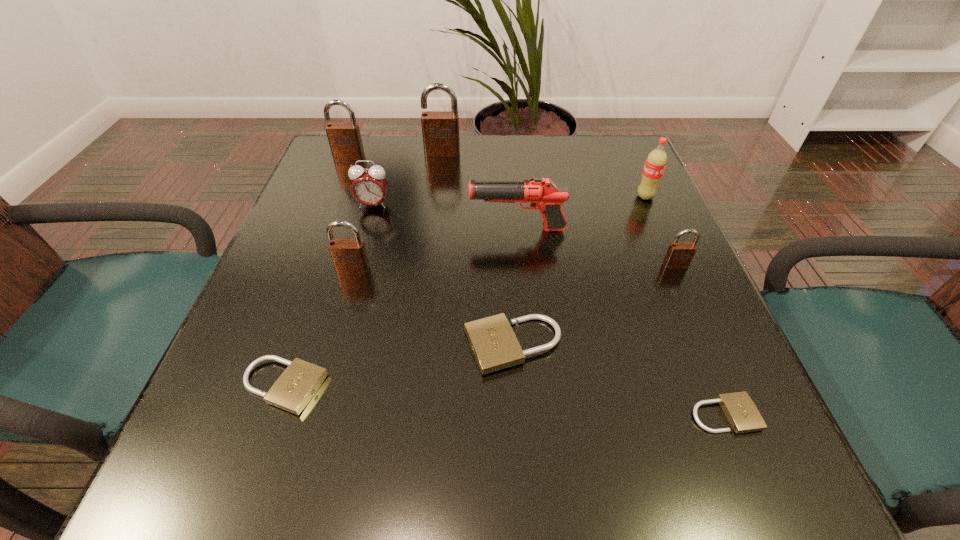
You are a GUI agent. You are given a task and a screenshot of the screen. Output one action in this format:
    pyautogui.click(x=<x>, y=<y>)
    Task: Click on the second brown padlock from right to left
    The image size is (960, 540).
    Given the screenshot: What is the action you would take?
    pyautogui.click(x=440, y=129)

Identify the location of the fifth object from left to right. The image size is (960, 540). (440, 129).

Locate an element on the screen. the leftmost brown padlock is located at coordinates (345, 141).

Find the location of a particular element. the second biggest brown padlock is located at coordinates (345, 141).

Where is `soda`? The width and height of the screenshot is (960, 540). soda is located at coordinates (655, 163).

You are a GUI agent. You are given a task and a screenshot of the screen. Output one action in this format:
    pyautogui.click(x=<x>, y=<y>)
    Task: Click on the black gun
    The height and width of the screenshot is (540, 960).
    Given the screenshot: What is the action you would take?
    pyautogui.click(x=542, y=193)

Where is `gun`? The width and height of the screenshot is (960, 540). gun is located at coordinates (542, 193).

Locate an element on the screen. the third biggest brown padlock is located at coordinates pyautogui.click(x=349, y=256).

The image size is (960, 540). What are the coordinates of `the third tallest padlock` in the screenshot? It's located at (349, 256).

Locate an element on the screen. The width and height of the screenshot is (960, 540). alarm clock is located at coordinates (369, 186).